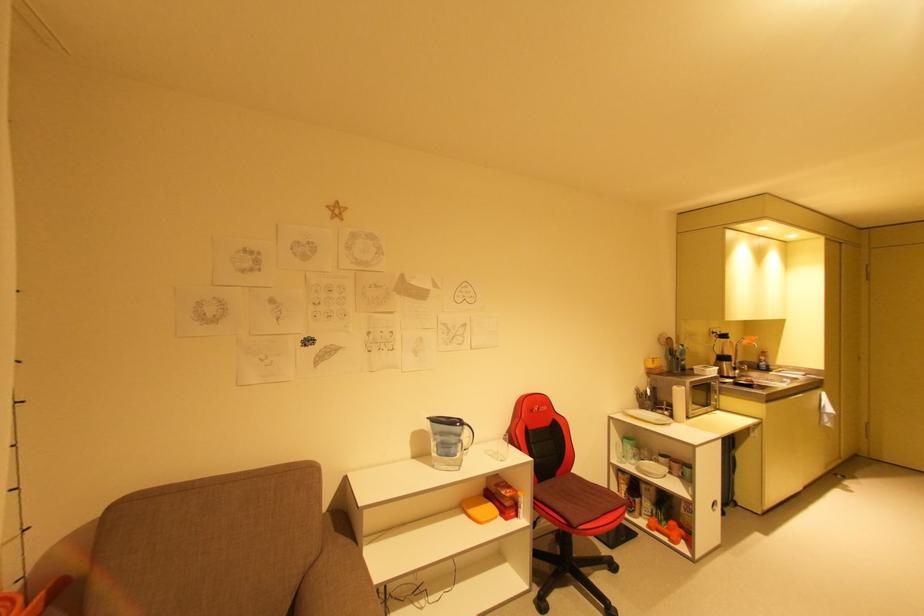
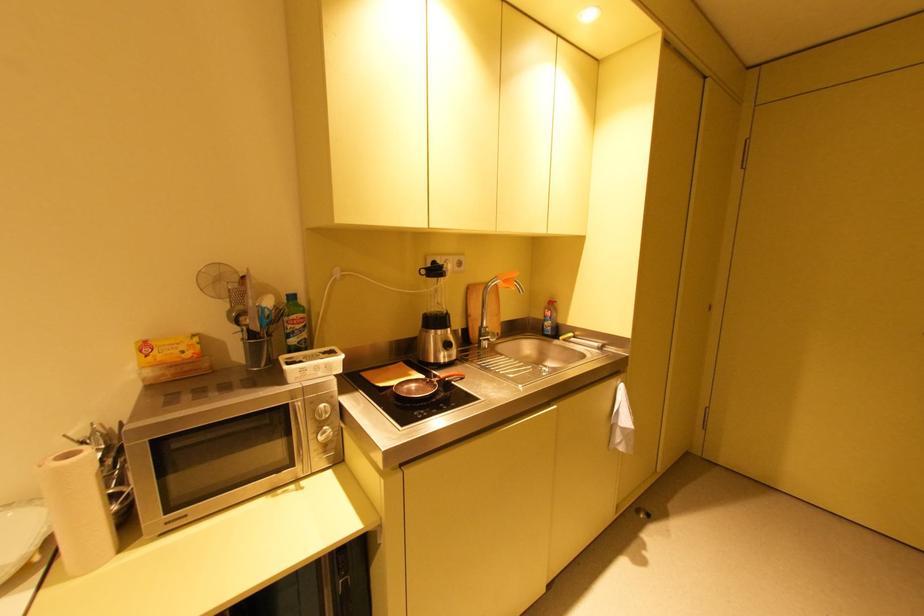
Locate, in the second image, the point that corresponds to (x=733, y=334) in the first image.

(444, 267)